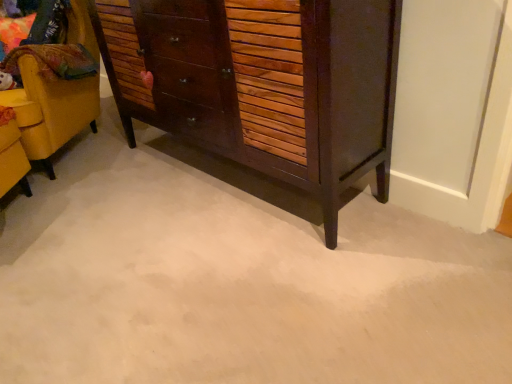
Question: Is wooden cabinet at right at the right side of dark brown wood chest of drawers at center?

Choices:
 (A) yes
 (B) no

Answer: (B)

Question: Does wooden cabinet at right have a larger size compared to dark brown wood chest of drawers at center?

Choices:
 (A) no
 (B) yes

Answer: (B)

Question: Considering the relative sizes of wooden cabinet at right and dark brown wood chest of drawers at center in the image provided, is wooden cabinet at right shorter than dark brown wood chest of drawers at center?

Choices:
 (A) yes
 (B) no

Answer: (B)

Question: Does wooden cabinet at right turn towards dark brown wood chest of drawers at center?

Choices:
 (A) no
 (B) yes

Answer: (A)

Question: Would you say wooden cabinet at right is outside dark brown wood chest of drawers at center?

Choices:
 (A) no
 (B) yes

Answer: (B)

Question: Does wooden cabinet at right have a lesser width compared to dark brown wood chest of drawers at center?

Choices:
 (A) yes
 (B) no

Answer: (B)

Question: From the image's perspective, is dark brown wood chest of drawers at center located above wooden cabinet at right?

Choices:
 (A) yes
 (B) no

Answer: (B)

Question: From a real-world perspective, is dark brown wood chest of drawers at center physically above wooden cabinet at right?

Choices:
 (A) yes
 (B) no

Answer: (A)

Question: Does dark brown wood chest of drawers at center contain wooden cabinet at right?

Choices:
 (A) yes
 (B) no

Answer: (B)

Question: Is dark brown wood chest of drawers at center beside wooden cabinet at right?

Choices:
 (A) no
 (B) yes

Answer: (A)

Question: From a real-world perspective, is dark brown wood chest of drawers at center under wooden cabinet at right?

Choices:
 (A) yes
 (B) no

Answer: (B)

Question: Is dark brown wood chest of drawers at center oriented towards wooden cabinet at right?

Choices:
 (A) yes
 (B) no

Answer: (B)

Question: Considering the positions of wooden cabinet at right and dark brown wood chest of drawers at center in the image, is wooden cabinet at right wider or thinner than dark brown wood chest of drawers at center?

Choices:
 (A) wide
 (B) thin

Answer: (A)